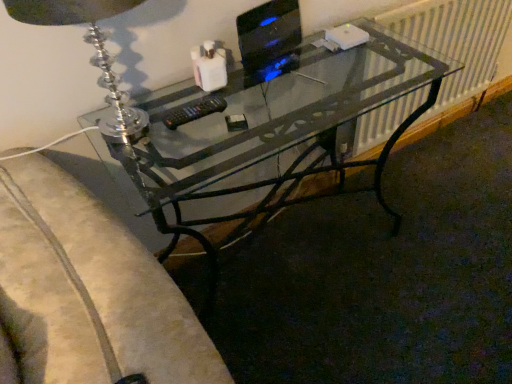
Question: Based on their sizes in the image, would you say clear glass table lamp at upper left is bigger or smaller than black plastic remote at center?

Choices:
 (A) big
 (B) small

Answer: (A)

Question: From a real-world perspective, is clear glass table lamp at upper left positioned above or below black plastic remote at center?

Choices:
 (A) below
 (B) above

Answer: (B)

Question: Based on their relative distances, which object is nearer to the transparent glass desk at center?

Choices:
 (A) metallic silver radiator at right
 (B) black plastic remote at center
 (C) black glossy monitor at upper right
 (D) clear glass table lamp at upper left

Answer: (C)

Question: Which object is positioned closest to the clear glass table lamp at upper left?

Choices:
 (A) black plastic remote at center
 (B) metallic silver radiator at right
 (C) black glossy monitor at upper right
 (D) transparent glass desk at center

Answer: (A)